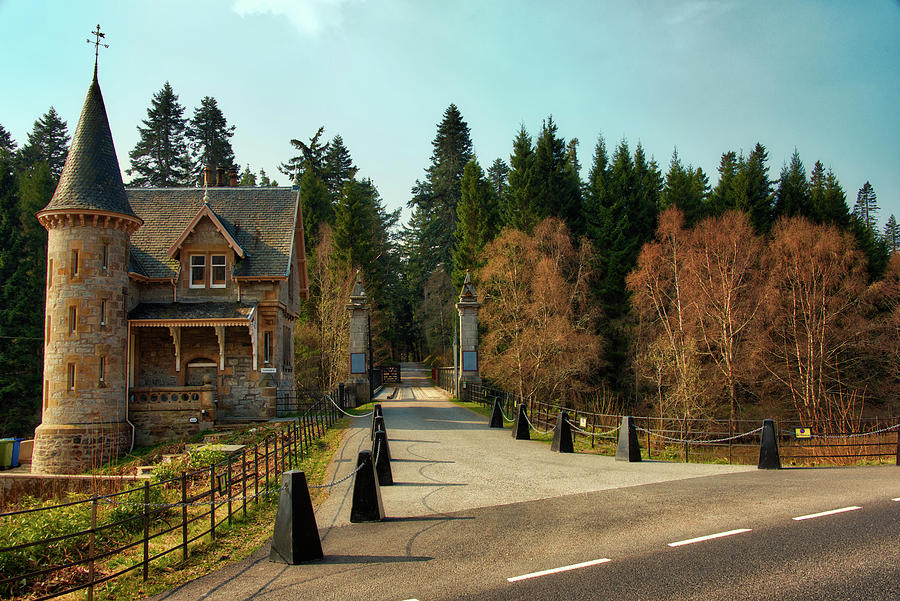
Image resolution: width=900 pixels, height=601 pixels. Identify the location of pillar. pos(72,264).